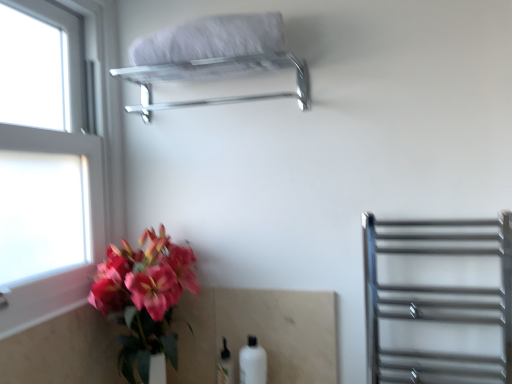
Question: Is the depth of polished chrome towel rack at upper center less than that of white glass window at left?

Choices:
 (A) yes
 (B) no

Answer: (B)

Question: Can you confirm if polished chrome towel rack at upper center is smaller than white glass window at left?

Choices:
 (A) no
 (B) yes

Answer: (B)

Question: Is polished chrome towel rack at upper center positioned beyond the bounds of white glass window at left?

Choices:
 (A) no
 (B) yes

Answer: (B)

Question: Does polished chrome towel rack at upper center have a larger size compared to white glass window at left?

Choices:
 (A) yes
 (B) no

Answer: (B)

Question: Can you confirm if polished chrome towel rack at upper center is shorter than white glass window at left?

Choices:
 (A) no
 (B) yes

Answer: (B)

Question: Based on their positions, is polished chrome towel rack at upper center located to the left or right of white matte bottle at lower center, the 2th bottle positioned from the right?

Choices:
 (A) right
 (B) left

Answer: (B)

Question: From the image's perspective, relative to white matte bottle at lower center, which ranks as the first bottle in left-to-right order, is polished chrome towel rack at upper center above or below?

Choices:
 (A) above
 (B) below

Answer: (A)

Question: Considering the positions of point (215, 18) and point (231, 369), is point (215, 18) closer or farther from the camera than point (231, 369)?

Choices:
 (A) farther
 (B) closer

Answer: (B)

Question: Is polished chrome towel rack at upper center taller or shorter than white matte bottle at lower center, the 2th bottle positioned from the right?

Choices:
 (A) tall
 (B) short

Answer: (B)

Question: Considering the positions of point (247, 352) and point (53, 206), is point (247, 352) closer or farther from the camera than point (53, 206)?

Choices:
 (A) closer
 (B) farther

Answer: (B)

Question: From a real-world perspective, is white matte bottle at lower center, the second bottle from the left, positioned above or below white glass window at left?

Choices:
 (A) above
 (B) below

Answer: (B)

Question: In terms of height, does white matte bottle at lower center, the second bottle from the left, look taller or shorter compared to white glass window at left?

Choices:
 (A) short
 (B) tall

Answer: (A)

Question: Considering the relative positions of white matte bottle at lower center, the second bottle from the left, and white glass window at left in the image provided, is white matte bottle at lower center, the second bottle from the left, to the left or to the right of white glass window at left?

Choices:
 (A) right
 (B) left

Answer: (A)

Question: Is polished chrome towel rack at upper center bigger or smaller than white fluffy towel at upper center?

Choices:
 (A) small
 (B) big

Answer: (B)

Question: Is polished chrome towel rack at upper center spatially inside white fluffy towel at upper center, or outside of it?

Choices:
 (A) outside
 (B) inside

Answer: (A)